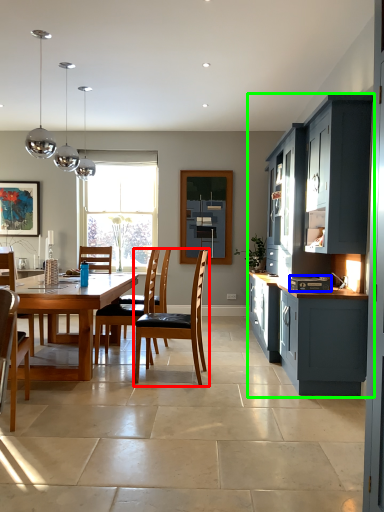
Question: Which object is the closest to the chair (highlighted by a red box)? Choose among these: appliance (highlighted by a blue box) or cabinetry (highlighted by a green box).

Choices:
 (A) appliance
 (B) cabinetry

Answer: (A)